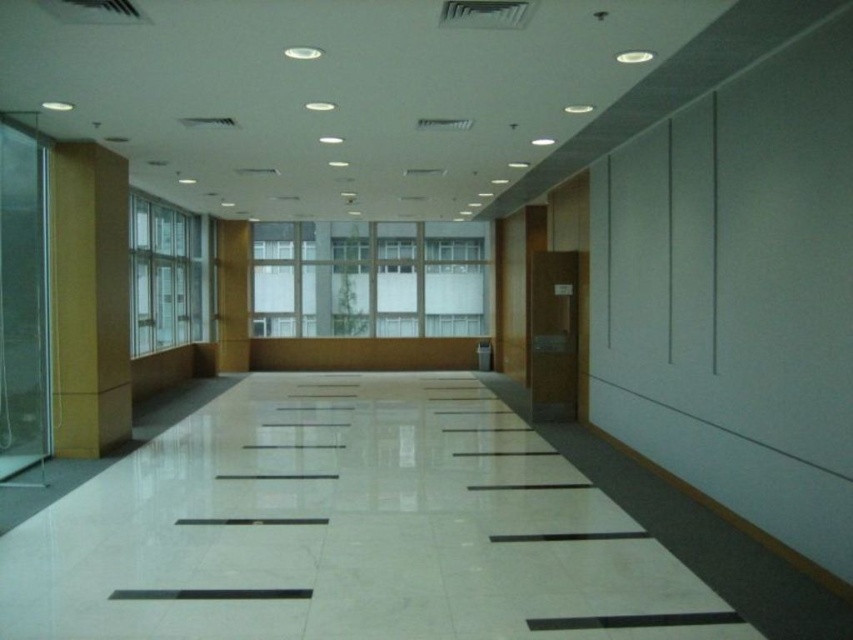
You are standing at the entrance of the corridor and want to find the clear glass window at center. According to the coordinates provided, in which direction should you walk to reach it?

The clear glass window at center is located at coordinates point (x=367, y=278). Since the entrance is likely at one end of the corridor, you should walk forward along the corridor towards the center point to reach the clear glass window at center.

You are a maintenance worker needing to clean a window in the corridor. You have a ladder that is 12 feet long. The clear glass window at center and the clear glass window at left are both in need of cleaning. Can you reach both windows with your ladder without moving it?

The distance between the clear glass window at center and the clear glass window at left is 13.80 feet. Since the ladder is only 12 feet long, you cannot move it to reach both windows as the distance exceeds the ladder length.

You are a painter who needs to know which object on the left side of the corridor is taller. Which one is taller between the matte yellow wall at left and the clear glass window at left?

The matte yellow wall at left is taller than the clear glass window at left.